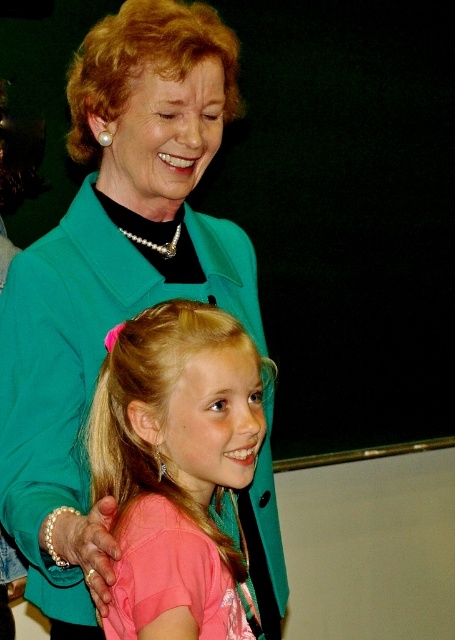
Question: Considering the relative positions of pink satin dress at center and blonde silky hair at upper left in the image provided, where is pink satin dress at center located with respect to blonde silky hair at upper left?

Choices:
 (A) right
 (B) left

Answer: (A)

Question: Which point is closer to the camera taking this photo?

Choices:
 (A) 121,540
 (B) 31,308
 (C) 156,45

Answer: (A)

Question: Among these points, which one is nearest to the camera?

Choices:
 (A) pyautogui.click(x=175, y=3)
 (B) pyautogui.click(x=120, y=588)

Answer: (B)

Question: Which of the following is the closest to the observer?

Choices:
 (A) teal fabric jacket at upper left
 (B) blonde silky hair at upper left

Answer: (A)

Question: Can you confirm if teal fabric jacket at upper left is positioned above blonde silky hair at upper left?

Choices:
 (A) no
 (B) yes

Answer: (A)

Question: In this image, where is teal fabric jacket at upper left located relative to blonde silky hair at upper left?

Choices:
 (A) below
 (B) above

Answer: (A)